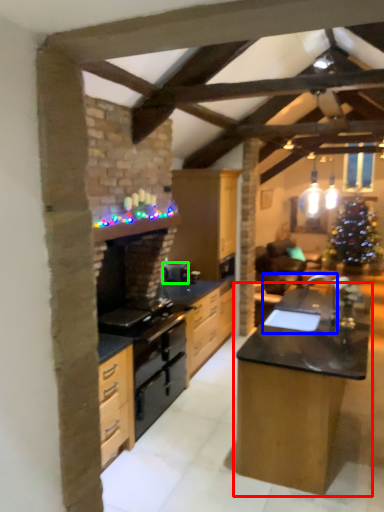
Question: Based on their relative distances, which object is nearer to table (highlighted by a red box)? Choose from sink (highlighted by a blue box) and appliance (highlighted by a green box).

Choices:
 (A) sink
 (B) appliance

Answer: (A)